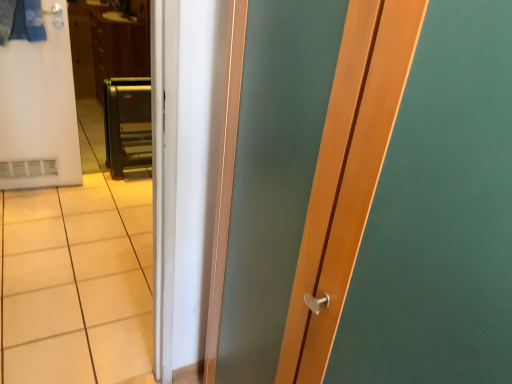
Measure the distance between metallic gray step ladder at center and camera.

The depth of metallic gray step ladder at center is 8.72 feet.

The image size is (512, 384). Find the location of `metallic gray step ladder at center`. metallic gray step ladder at center is located at coordinates (127, 125).

What do you see at coordinates (106, 47) in the screenshot? Image resolution: width=512 pixels, height=384 pixels. I see `brown wood dresser at upper left` at bounding box center [106, 47].

Where is `metallic gray step ladder at center`? This screenshot has width=512, height=384. metallic gray step ladder at center is located at coordinates (127, 125).

In the image, there is a metallic gray step ladder at center. Where is `dresser above it (from the image's perspective)`? Image resolution: width=512 pixels, height=384 pixels. dresser above it (from the image's perspective) is located at coordinates (106, 47).

From the image's perspective, is metallic gray step ladder at center above or below brown wood dresser at upper left?

Clearly, from the image's perspective, metallic gray step ladder at center is below brown wood dresser at upper left.

From a real-world perspective, which is physically below, metallic gray step ladder at center or brown wood dresser at upper left?

metallic gray step ladder at center is physically lower.

Does metallic gray step ladder at center have a larger size compared to brown wood dresser at upper left?

No.

From a real-world perspective, does brown wood dresser at upper left sit lower than white matte refrigerator at left?

Yes, from a real-world perspective, brown wood dresser at upper left is beneath white matte refrigerator at left.

Does brown wood dresser at upper left have a greater width compared to white matte refrigerator at left?

Indeed, brown wood dresser at upper left has a greater width compared to white matte refrigerator at left.

Considering the relative sizes of brown wood dresser at upper left and white matte refrigerator at left in the image provided, is brown wood dresser at upper left shorter than white matte refrigerator at left?

Indeed, brown wood dresser at upper left has a lesser height compared to white matte refrigerator at left.

Is brown wood dresser at upper left facing away from white matte refrigerator at left?

No, brown wood dresser at upper left's orientation is not away from white matte refrigerator at left.

Is white matte refrigerator at left oriented away from metallic gray step ladder at center?

No, white matte refrigerator at left is not facing the opposite direction of metallic gray step ladder at center.

From the image's perspective, which one is positioned lower, white matte refrigerator at left or metallic gray step ladder at center?

metallic gray step ladder at center.

Which object is thinner, white matte refrigerator at left or metallic gray step ladder at center?

white matte refrigerator at left is thinner.

Which is more to the left, white matte refrigerator at left or metallic gray step ladder at center?

From the viewer's perspective, white matte refrigerator at left appears more on the left side.

Considering the relative sizes of white matte refrigerator at left and brown wood dresser at upper left in the image provided, is white matte refrigerator at left smaller than brown wood dresser at upper left?

Indeed, white matte refrigerator at left has a smaller size compared to brown wood dresser at upper left.

In the scene shown: Would you say white matte refrigerator at left contains brown wood dresser at upper left?

No, brown wood dresser at upper left is not surrounded by white matte refrigerator at left.

Is white matte refrigerator at left wider than brown wood dresser at upper left?

In fact, white matte refrigerator at left might be narrower than brown wood dresser at upper left.

From the picture: Considering the positions of objects white matte refrigerator at left and brown wood dresser at upper left in the image provided, who is in front, white matte refrigerator at left or brown wood dresser at upper left?

white matte refrigerator at left is more forward.

Which of these two, brown wood dresser at upper left or metallic gray step ladder at center, is smaller?

Smaller between the two is metallic gray step ladder at center.

Does brown wood dresser at upper left have a greater height compared to metallic gray step ladder at center?

Yes, brown wood dresser at upper left is taller than metallic gray step ladder at center.

Is brown wood dresser at upper left oriented towards metallic gray step ladder at center?

No.

Considering the points (119, 130) and (19, 167), which point is behind, point (119, 130) or point (19, 167)?

The point (119, 130) is more distant.

Would you say metallic gray step ladder at center is outside white matte refrigerator at left?

Indeed, metallic gray step ladder at center is completely outside white matte refrigerator at left.

Is metallic gray step ladder at center thinner than white matte refrigerator at left?

No, metallic gray step ladder at center is not thinner than white matte refrigerator at left.

At what (x,y) coordinates should I click in order to perform the action: click on door lying above the metallic gray step ladder at center (from the image's perspective). Please return your answer as a coordinate pair (x, y). Image resolution: width=512 pixels, height=384 pixels. Looking at the image, I should click on (x=39, y=108).

Identify the location of dresser behind the metallic gray step ladder at center. This screenshot has width=512, height=384. (106, 47).

The width and height of the screenshot is (512, 384). In order to click on door in front of the brown wood dresser at upper left in this screenshot , I will do `click(39, 108)`.

Considering their positions, is metallic gray step ladder at center positioned further to white matte refrigerator at left than brown wood dresser at upper left?

The object further to white matte refrigerator at left is brown wood dresser at upper left.

Looking at this image, based on their spatial positions, is brown wood dresser at upper left or metallic gray step ladder at center further from white matte refrigerator at left?

The object further to white matte refrigerator at left is brown wood dresser at upper left.

Based on their spatial positions, is brown wood dresser at upper left or white matte refrigerator at left further from metallic gray step ladder at center?

white matte refrigerator at left lies further to metallic gray step ladder at center than the other object.

Considering their positions, is white matte refrigerator at left positioned further to brown wood dresser at upper left than metallic gray step ladder at center?

white matte refrigerator at left is positioned further to the anchor brown wood dresser at upper left.

Considering their positions, is white matte refrigerator at left positioned further to metallic gray step ladder at center than brown wood dresser at upper left?

white matte refrigerator at left lies further to metallic gray step ladder at center than the other object.

Based on their spatial positions, is metallic gray step ladder at center or white matte refrigerator at left further from brown wood dresser at upper left?

Based on the image, white matte refrigerator at left appears to be further to brown wood dresser at upper left.

You are a GUI agent. You are given a task and a screenshot of the screen. Output one action in this format:
    pyautogui.click(x=<x>, y=<y>)
    Task: Click on the furniture between white matte refrigerator at left and brown wood dresser at upper left along the z-axis
    
    Given the screenshot: What is the action you would take?
    pyautogui.click(x=127, y=125)